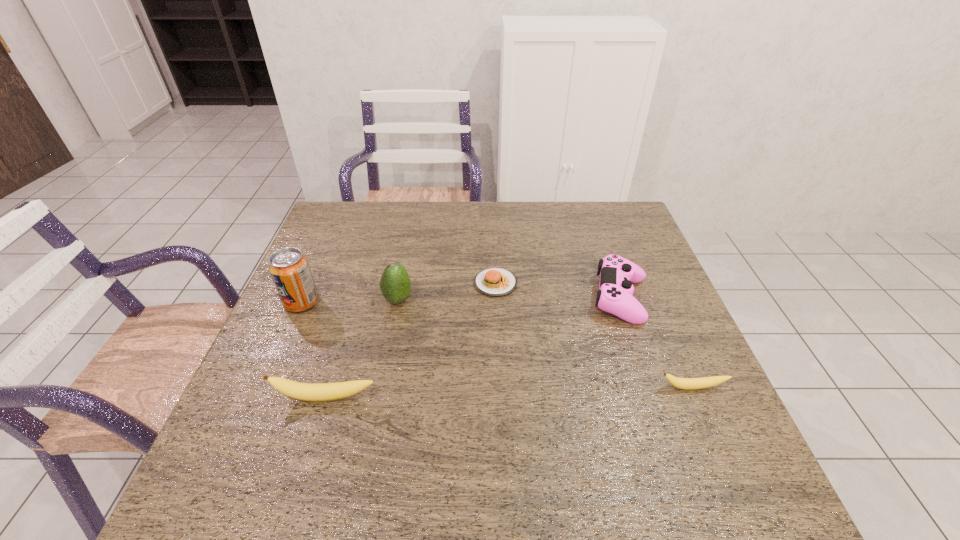
Where is `blank region between the left banana and the control`? blank region between the left banana and the control is located at coordinates (473, 348).

At what (x,y) coordinates should I click in order to perform the action: click on unoccupied area between the fifth shortest object and the shortest object. Please return your answer as a coordinate pair (x, y). Looking at the image, I should click on (446, 292).

The height and width of the screenshot is (540, 960). Identify the location of free spot between the control and the right banana. (657, 343).

Locate an element on the screen. free area in between the left banana and the soda can is located at coordinates (314, 350).

Locate an element on the screen. This screenshot has width=960, height=540. object that stands as the third closest to the avocado is located at coordinates (302, 391).

Identify which object is the fourth closest to the fourth object from left to right. Please provide its 2D coordinates. Your answer should be formatted as a tuple, i.e. [(x, y)], where the tuple contains the x and y coordinates of a point satisfying the conditions above.

[(682, 383)]

Identify the location of free location that satisfies the following two spatial constraints: 1. on the front side of the control; 2. on the right side of the food. The height and width of the screenshot is (540, 960). (496, 298).